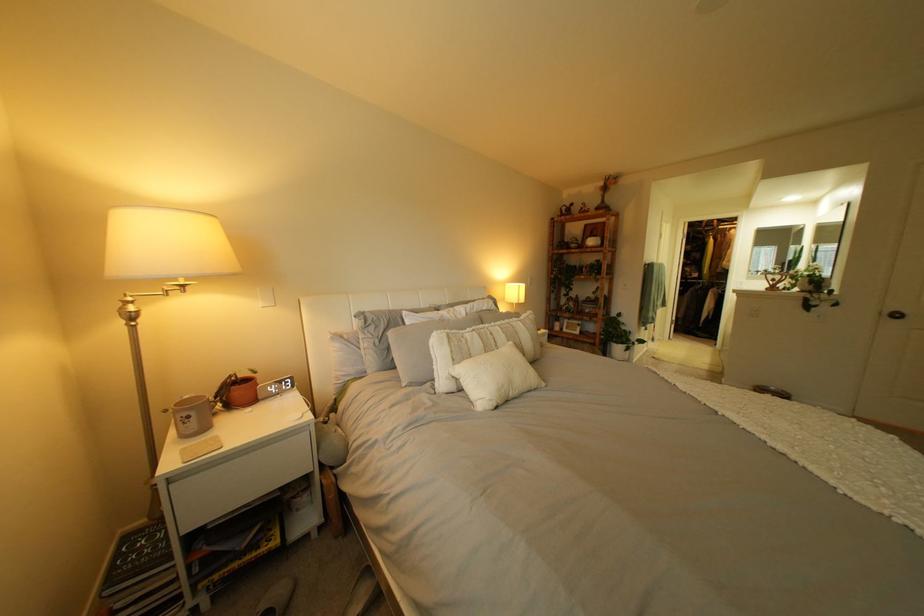
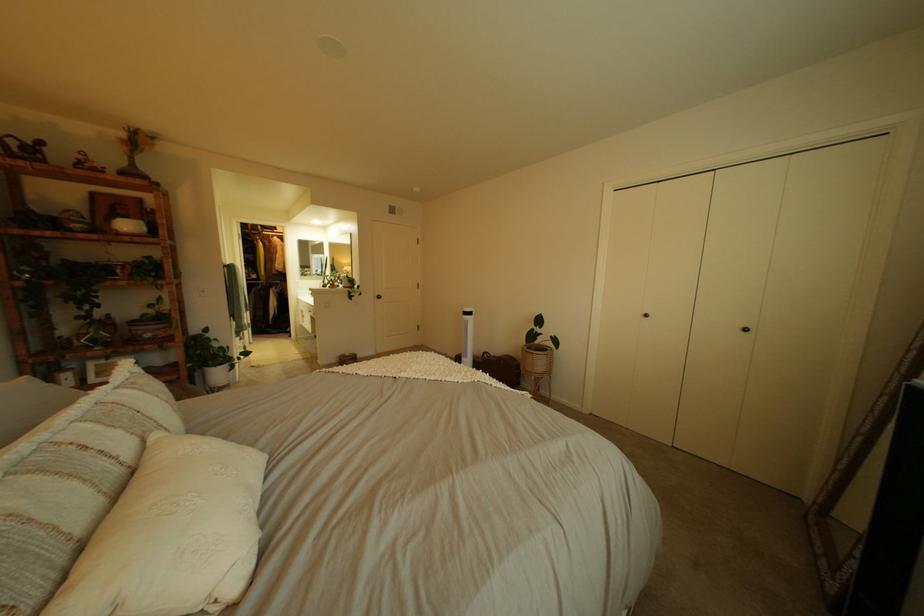
Where in the second image is the point corresponding to pixel 518 337 from the first image?

(134, 434)